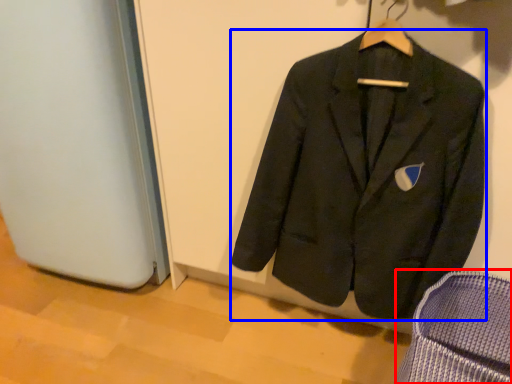
Question: Which point is further to the camera, armchair (highlighted by a red box) or suit (highlighted by a blue box)?

Choices:
 (A) armchair
 (B) suit

Answer: (B)